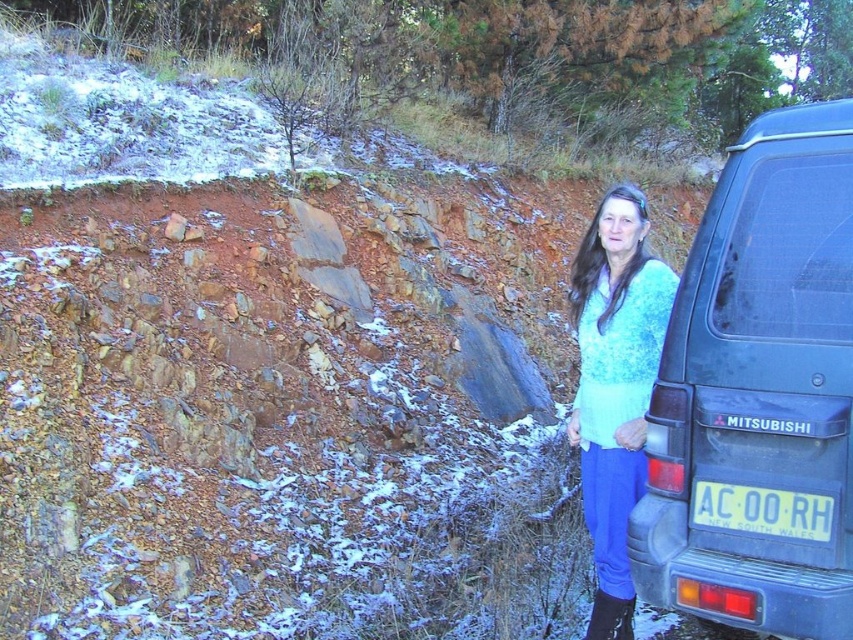
Based on the photo, you are a photographer trying to capture the matte blue suv at right and the yellow plastic license plate at lower right in the same frame. Given that the camera can only focus on objects within a 1.5 meter width, will both objects fit in the frame?

The matte blue suv at right is wider than the yellow plastic license plate at lower right. Since the camera can only focus on objects within a 1.5 meter width, if the SUV is wider than 1.5 meters, it won

Based on the scene description, can you determine the spatial relationship between the light blue knitted sweater at center and the yellow plastic license plate at lower right?

The light blue knitted sweater at center is to the left of the yellow plastic license plate at lower right.

You are a fashion designer observing the scene. You need to decide which item is wider between the light blue knitted sweater at center and the yellow plastic license plate at lower right. Which one is wider?

The light blue knitted sweater at center is wider than the yellow plastic license plate at lower right according to the description.